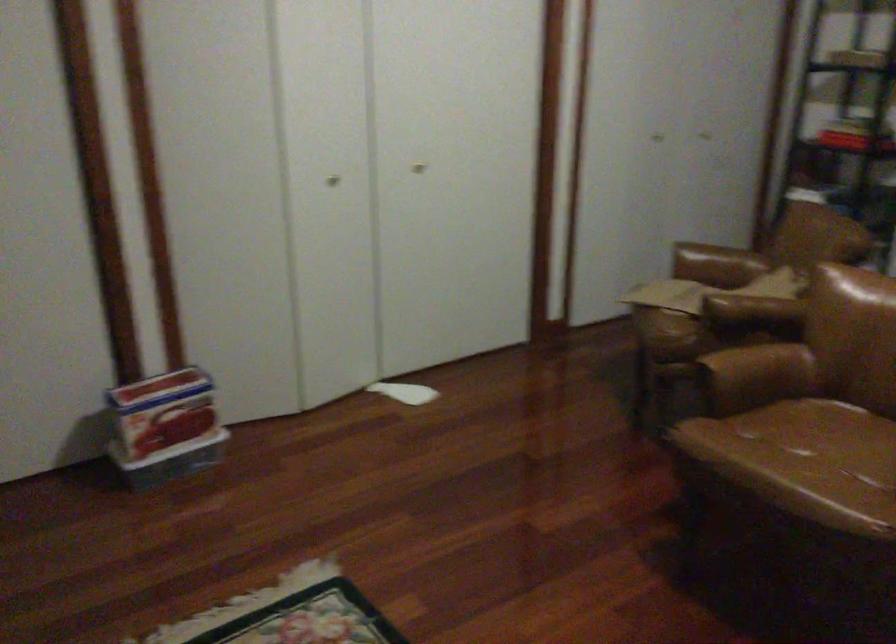
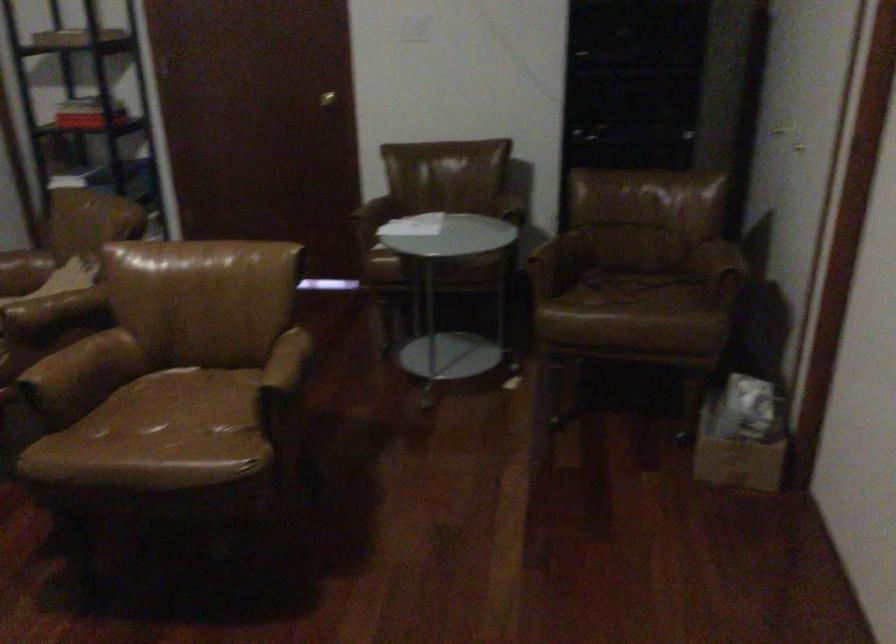
Where in the second image is the point corresponding to point (728, 361) from the first image?

(61, 361)